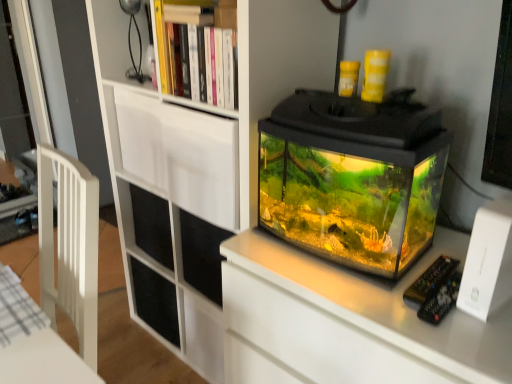
Question: Is white matte drawer at upper center thinner than transparent glass tank at center?

Choices:
 (A) no
 (B) yes

Answer: (B)

Question: Is white matte drawer at upper center beside transparent glass tank at center?

Choices:
 (A) no
 (B) yes

Answer: (A)

Question: Is white matte drawer at upper center positioned beyond the bounds of transparent glass tank at center?

Choices:
 (A) yes
 (B) no

Answer: (A)

Question: From a real-world perspective, is white matte drawer at upper center on top of transparent glass tank at center?

Choices:
 (A) yes
 (B) no

Answer: (B)

Question: Does white matte drawer at upper center have a greater width compared to transparent glass tank at center?

Choices:
 (A) no
 (B) yes

Answer: (A)

Question: From the image's perspective, is white matte drawer at upper center located beneath transparent glass tank at center?

Choices:
 (A) yes
 (B) no

Answer: (B)

Question: Is white matte drawer at upper center shorter than white matte bookcase at upper center?

Choices:
 (A) no
 (B) yes

Answer: (B)

Question: Does white matte drawer at upper center have a greater width compared to white matte bookcase at upper center?

Choices:
 (A) no
 (B) yes

Answer: (A)

Question: From the image's perspective, is white matte drawer at upper center located beneath white matte bookcase at upper center?

Choices:
 (A) no
 (B) yes

Answer: (A)

Question: Would you say white matte bookcase at upper center is part of white matte drawer at upper center's contents?

Choices:
 (A) yes
 (B) no

Answer: (B)

Question: Is white matte drawer at upper center taller than white matte bookcase at upper center?

Choices:
 (A) no
 (B) yes

Answer: (A)

Question: Is white matte drawer at upper center aimed at white matte bookcase at upper center?

Choices:
 (A) yes
 (B) no

Answer: (A)

Question: Is transparent glass tank at center facing away from white matte bookcase at upper center?

Choices:
 (A) yes
 (B) no

Answer: (B)